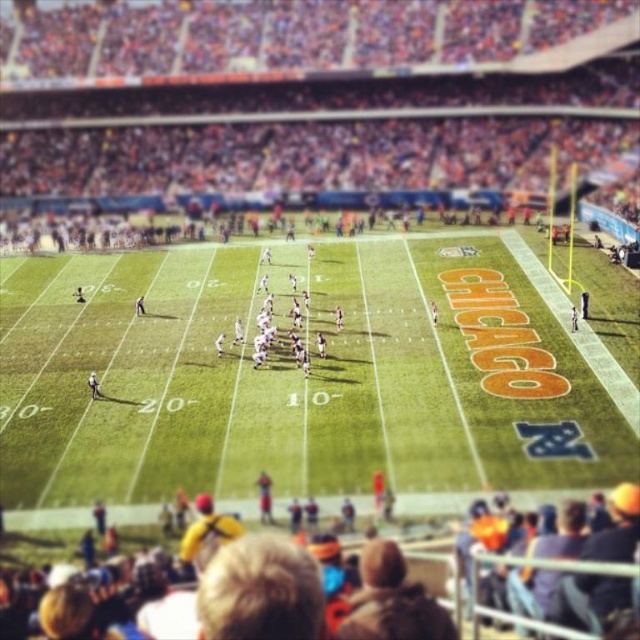
Question: Does multicolored fabric crowd at lower center come in front of white matte football team at center?

Choices:
 (A) no
 (B) yes

Answer: (B)

Question: Among these points, which one is farthest from the camera?

Choices:
 (A) (230, 593)
 (B) (285, 342)

Answer: (B)

Question: Does multicolored fabric crowd at lower center come behind white matte football team at center?

Choices:
 (A) no
 (B) yes

Answer: (A)

Question: Considering the relative positions of green grass field at center and multicolored fabric crowd at lower center in the image provided, where is green grass field at center located with respect to multicolored fabric crowd at lower center?

Choices:
 (A) right
 (B) left

Answer: (B)

Question: Considering the real-world distances, which object is farthest from the green grass field at center?

Choices:
 (A) white matte football team at center
 (B) multicolored fabric crowd at lower center

Answer: (B)

Question: Which of these objects is positioned closest to the white matte football team at center?

Choices:
 (A) multicolored fabric crowd at lower center
 (B) green grass field at center

Answer: (B)